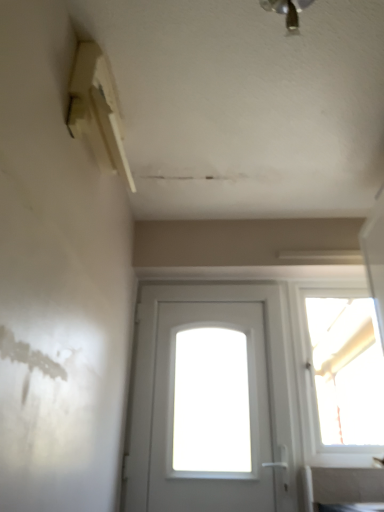
Question: Considering their positions, is metallic ceiling light at upper center located in front of or behind transparent glass window at upper right?

Choices:
 (A) front
 (B) behind

Answer: (A)

Question: Considering the positions of metallic ceiling light at upper center and transparent glass window at upper right in the image, is metallic ceiling light at upper center wider or thinner than transparent glass window at upper right?

Choices:
 (A) wide
 (B) thin

Answer: (A)

Question: Which is farther from the transparent glass window at upper right?

Choices:
 (A) white matte door at center
 (B) metallic ceiling light at upper center

Answer: (B)

Question: Which of these objects is positioned farthest from the white matte door at center?

Choices:
 (A) metallic ceiling light at upper center
 (B) transparent glass window at upper right

Answer: (A)